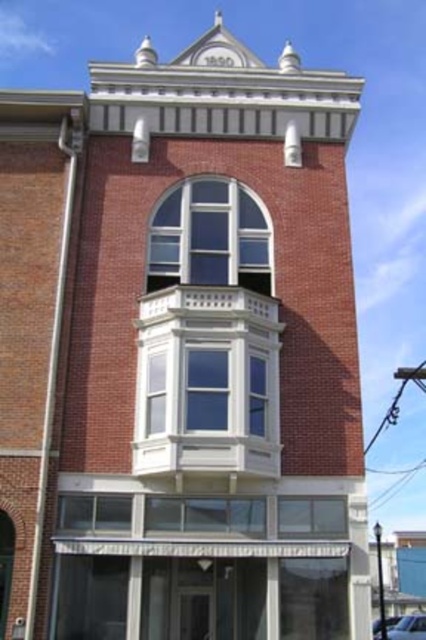
From the picture: You are standing in front of the two story brick building. You need to locate the clear glass window at center and the clear glass window at lower center. Which one is higher up on the building?

The clear glass window at center is located above the clear glass window at lower center, so the clear glass window at center is higher up on the building.

Based on the scene description, which clear glass window is wider? The clear glass window at center or the clear glass window at lower center?

The clear glass window at center is wider than the clear glass window at lower center according to the description.